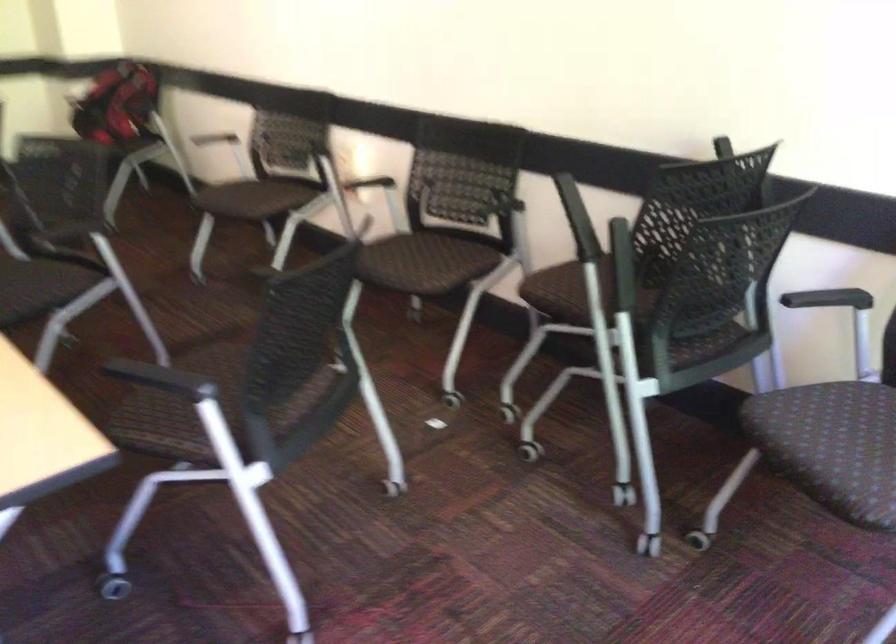
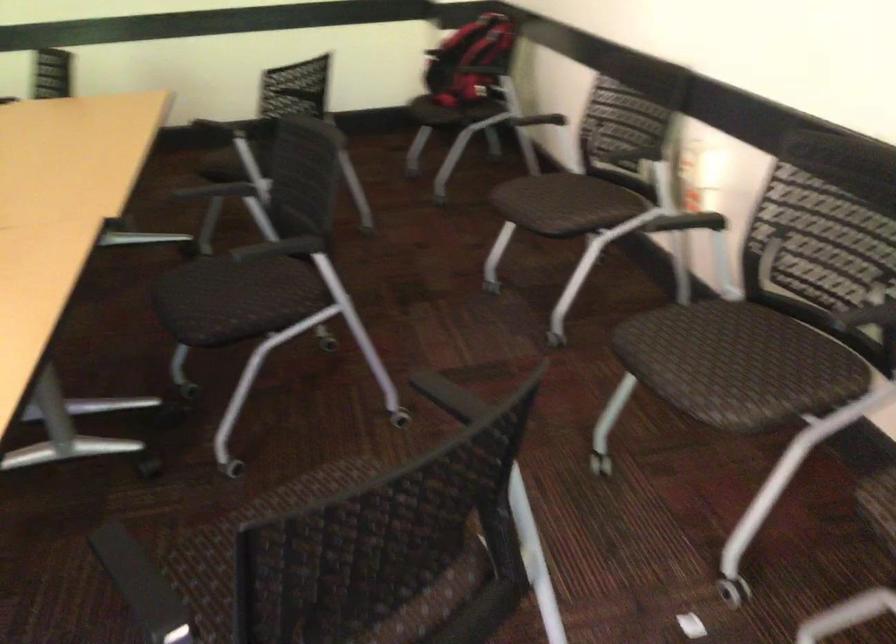
The point at [181,366] is marked in the first image. Where is the corresponding point in the second image?

(313, 487)